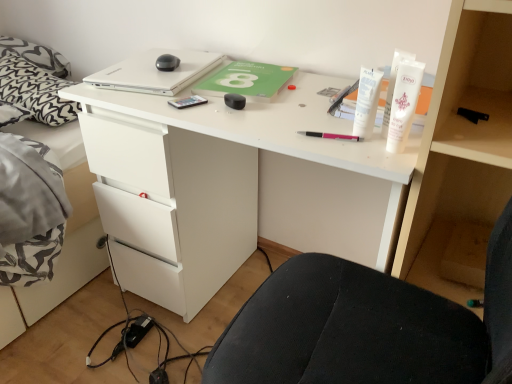
The width and height of the screenshot is (512, 384). In order to click on free space that is to the left of black rubberized mouse at center, which is counted as the second stationery, starting from the back in this screenshot , I will do `click(177, 101)`.